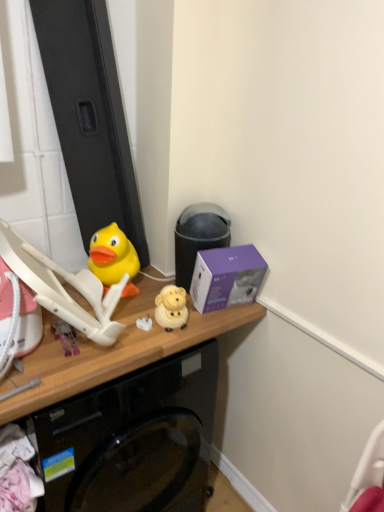
The height and width of the screenshot is (512, 384). Find the location of `vacant area that lies to the right of pink plastic toy at lower left, positioned as the fourth toy in right-to-left order`. vacant area that lies to the right of pink plastic toy at lower left, positioned as the fourth toy in right-to-left order is located at coordinates (127, 340).